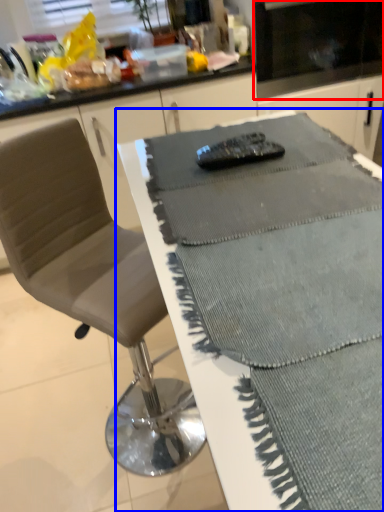
Question: Which point is further to the camera, appliance (highlighted by a red box) or table (highlighted by a blue box)?

Choices:
 (A) appliance
 (B) table

Answer: (A)